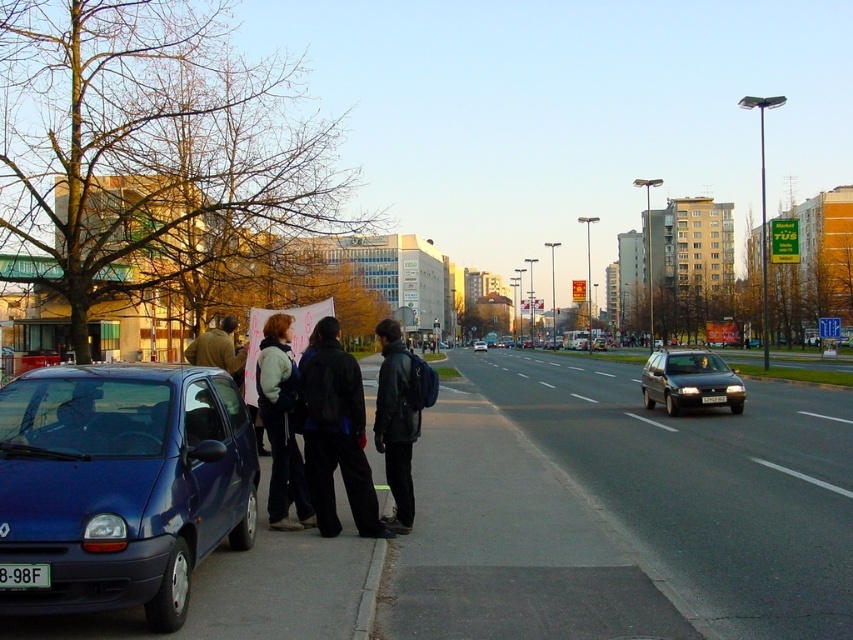
You are a pedestrian standing at the intersection and want to walk to the point where the pink banner is located. The pink banner is at point (726, 401). However, there is a parked car at point (595, 464). Will the parked car block your path to the pink banner?

Point (595, 464) is in front of point (726, 401), so the parked car at point (595, 464) will block your path to the pink banner at point (726, 401).